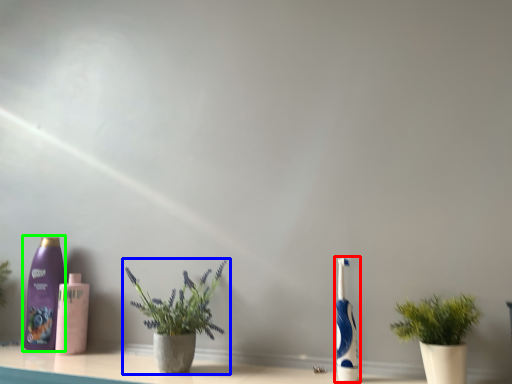
Question: Which object is positioned closest to toothbrush (highlighted by a red box)? Select from houseplant (highlighted by a blue box) and bottle (highlighted by a green box).

Choices:
 (A) houseplant
 (B) bottle

Answer: (A)